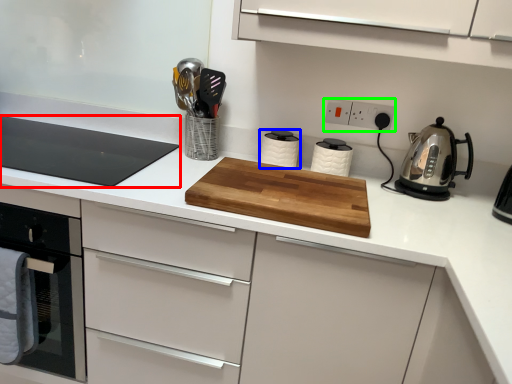
Question: Estimate the real-world distances between objects in this image. Which object is closer to gas stove (highlighted by a red box), kitchen appliance (highlighted by a blue box) or electric outlet (highlighted by a green box)?

Choices:
 (A) kitchen appliance
 (B) electric outlet

Answer: (A)